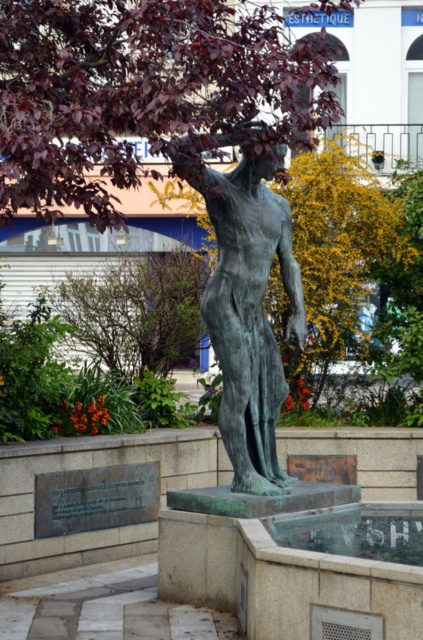
Question: Which point is farther to the camera?

Choices:
 (A) (266, 472)
 (B) (263, 147)

Answer: (A)

Question: Is dark red leafy tree at upper left positioned in front of bronze statue at center?

Choices:
 (A) yes
 (B) no

Answer: (B)

Question: Does dark red leafy tree at upper left appear under bronze statue at center?

Choices:
 (A) no
 (B) yes

Answer: (A)

Question: Can you confirm if dark red leafy tree at upper left is positioned below bronze statue at center?

Choices:
 (A) yes
 (B) no

Answer: (B)

Question: Which of the following is the farthest from the observer?

Choices:
 (A) bronze statue at center
 (B) dark red leafy tree at upper left

Answer: (B)